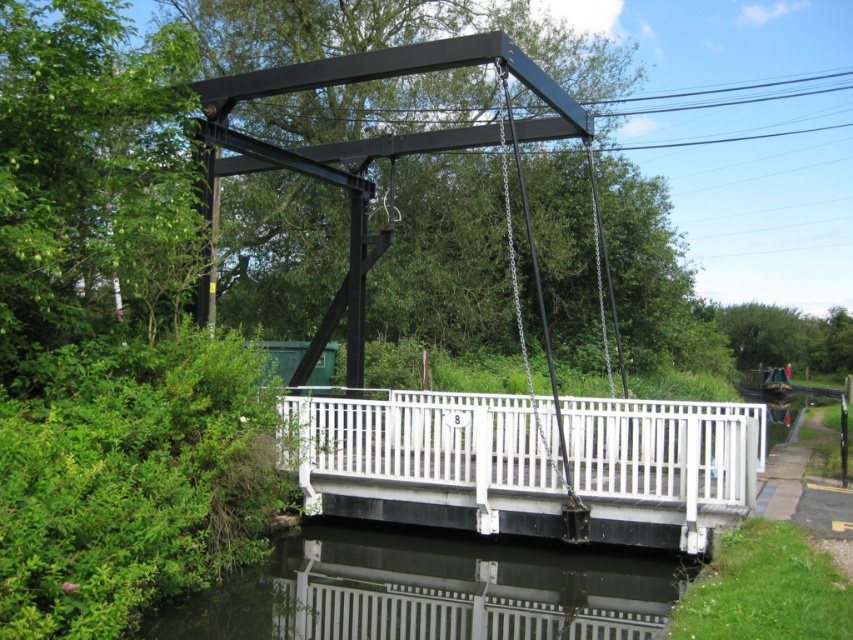
In the scene shown: Which is above, white painted wood bridge at center or transparent glass water at lower center?

white painted wood bridge at center

Is white painted wood bridge at center behind transparent glass water at lower center?

Yes, it is behind transparent glass water at lower center.

Which is behind, point (593, 529) or point (502, 566)?

Positioned behind is point (502, 566).

At what (x,y) coordinates should I click in order to perform the action: click on white painted wood bridge at center. Please return your answer as a coordinate pair (x, y). Looking at the image, I should click on (527, 461).